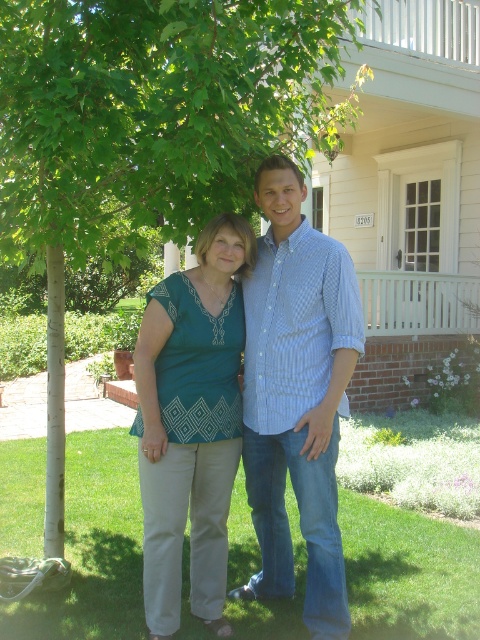
Is green leafy tree at upper left in front of teal fabric blouse at center?

Yes, it is.

Can you confirm if green leafy tree at upper left is wider than teal fabric blouse at center?

Yes, green leafy tree at upper left is wider than teal fabric blouse at center.

Is point (244, 72) positioned in front of point (168, 368)?

Yes, point (244, 72) is in front of point (168, 368).

Locate an element on the screen. The height and width of the screenshot is (640, 480). green leafy tree at upper left is located at coordinates (149, 131).

Which of these two, green leafy tree at upper left or blue checkered shirt at center, stands taller?

With more height is green leafy tree at upper left.

Is green leafy tree at upper left wider than blue checkered shirt at center?

Indeed, green leafy tree at upper left has a greater width compared to blue checkered shirt at center.

Between point (36, 124) and point (320, 636), which one is positioned behind?

The point (320, 636) is behind.

Locate an element on the screen. This screenshot has height=640, width=480. green leafy tree at upper left is located at coordinates (149, 131).

Does blue checkered shirt at center have a greater width compared to teal fabric blouse at center?

Correct, the width of blue checkered shirt at center exceeds that of teal fabric blouse at center.

Which is in front, point (255, 356) or point (180, 440)?

Point (180, 440) is in front.

Locate an element on the screen. blue checkered shirt at center is located at coordinates (297, 396).